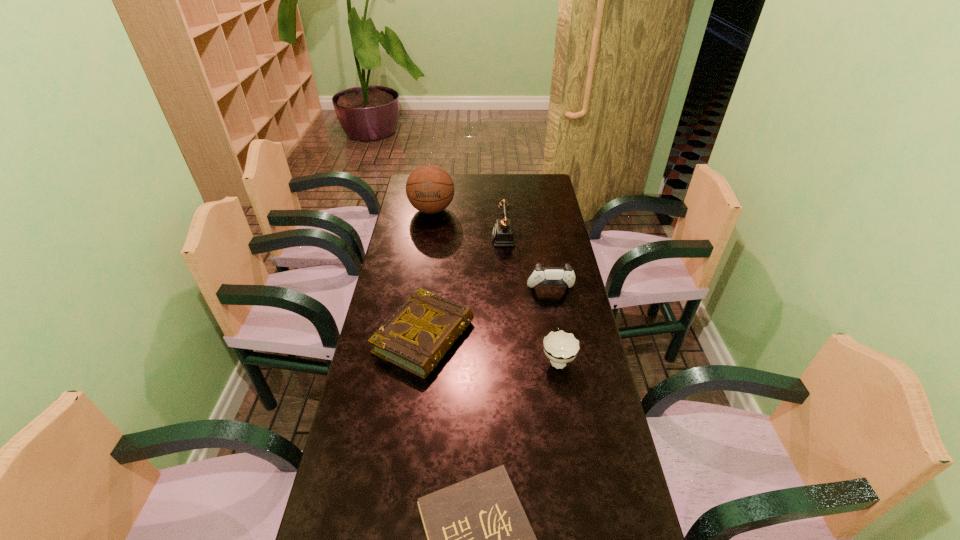
Locate an element on the screen. the tallest object is located at coordinates (430, 189).

Locate an element on the screen. The image size is (960, 540). the farthest object is located at coordinates (430, 189).

The height and width of the screenshot is (540, 960). I want to click on telephone, so click(x=503, y=235).

I want to click on the second tallest object, so click(x=503, y=235).

Identify the location of the fourth nearest object. The image size is (960, 540). (541, 275).

Locate an element on the screen. This screenshot has height=540, width=960. the third tallest object is located at coordinates (541, 275).

Locate an element on the screen. the fourth tallest object is located at coordinates (560, 347).

Identify the location of the farther hardback book. This screenshot has height=540, width=960. (416, 338).

I want to click on vacant position located 0.090m on the side with brand label of the basketball, so click(428, 235).

The width and height of the screenshot is (960, 540). I want to click on vacant space located on the front of the telephone at the rotary dial, so click(477, 239).